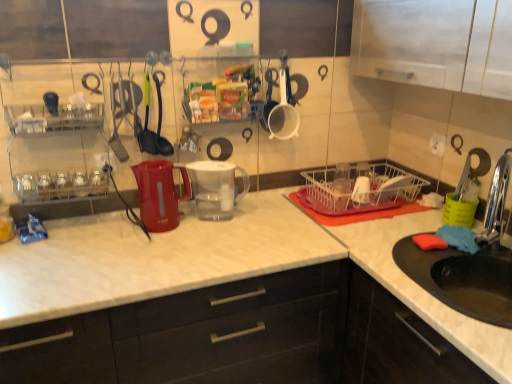
This screenshot has width=512, height=384. In order to click on free location to the right of transparent plastic water filter pitcher at center, acting as the 1th appliance starting from the right in this screenshot , I will do `click(265, 216)`.